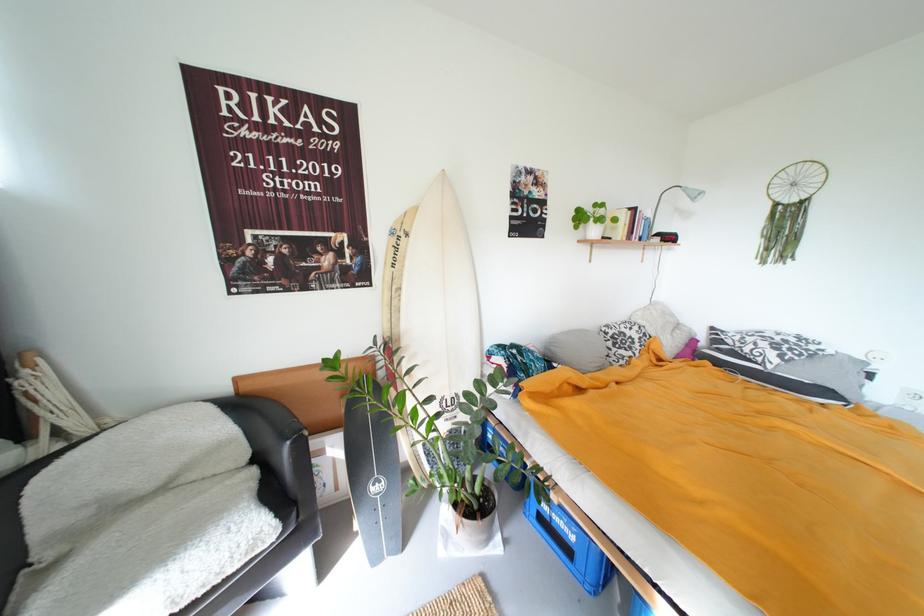
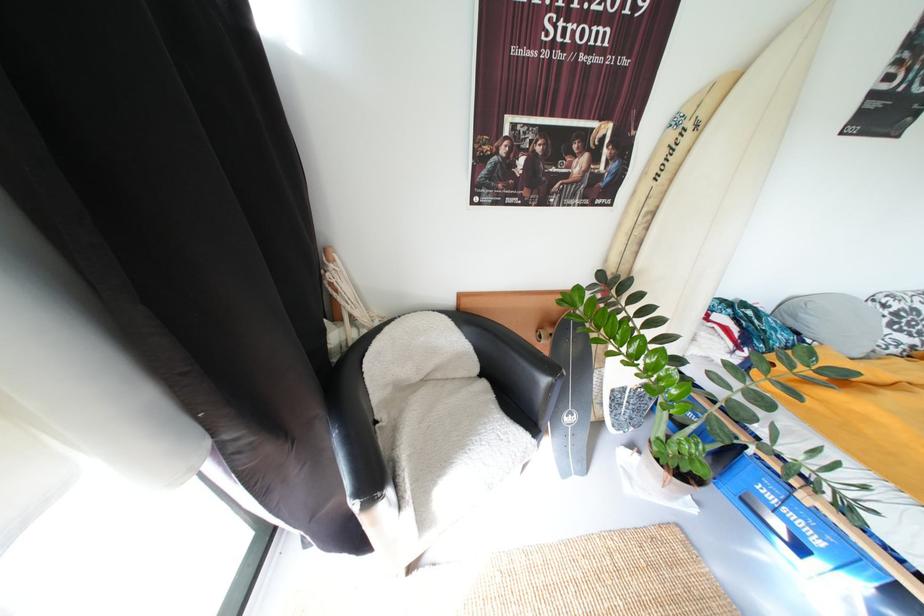
The images are taken continuously from a first-person perspective. In which direction is your viewpoint rotating?

The rotation direction of the camera is left-down.